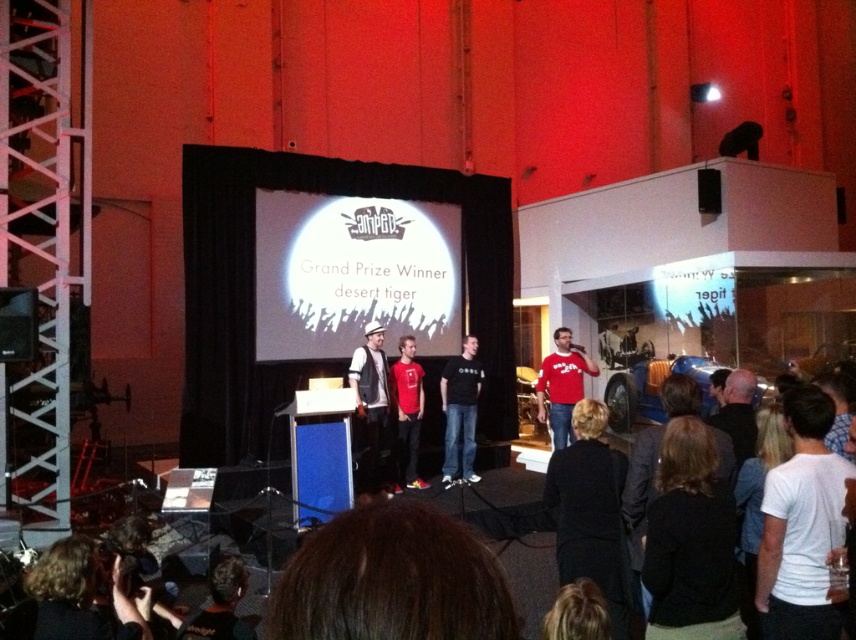
Question: Can you confirm if red cotton t-shirt at center is thinner than dark brown hair at lower center?

Choices:
 (A) no
 (B) yes

Answer: (B)

Question: Based on their relative distances, which object is farther from the white t-shirt at lower right?

Choices:
 (A) dark hair at lower left
 (B) black shirt at lower right
 (C) black matte shirt at center

Answer: (C)

Question: Is dark brown hair at lower center wider than black shirt at lower right?

Choices:
 (A) yes
 (B) no

Answer: (A)

Question: Can you confirm if black matte shirt at center is thinner than dark brown hair at lower center?

Choices:
 (A) yes
 (B) no

Answer: (A)

Question: Among these objects, which one is nearest to the camera?

Choices:
 (A) black leather jacket at lower right
 (B) black matte shirt at center
 (C) dark hair at lower left
 (D) red cotton t-shirt at center

Answer: (A)

Question: Which point appears farthest from the camera in this image?

Choices:
 (A) (415, 442)
 (B) (774, 515)

Answer: (A)